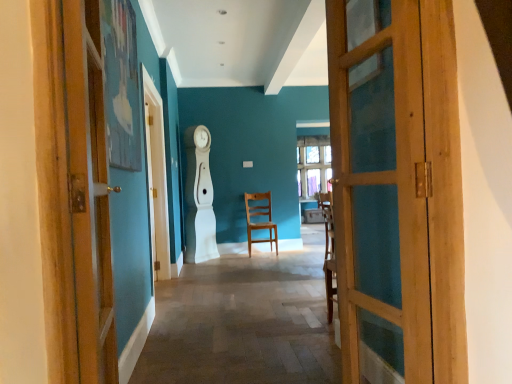
Question: Does wooden chair at center have a lesser width compared to wooden door at left, positioned as the 2th door in right-to-left order?

Choices:
 (A) no
 (B) yes

Answer: (A)

Question: Is wooden chair at center with wooden door at left, the first door viewed from the left?

Choices:
 (A) yes
 (B) no

Answer: (B)

Question: Is wooden chair at center taller than wooden door at left, positioned as the 2th door in right-to-left order?

Choices:
 (A) yes
 (B) no

Answer: (B)

Question: From a real-world perspective, is wooden chair at center on wooden door at left, positioned as the 2th door in right-to-left order?

Choices:
 (A) no
 (B) yes

Answer: (A)

Question: Is wooden chair at center at the left side of wooden door at left, positioned as the 2th door in right-to-left order?

Choices:
 (A) no
 (B) yes

Answer: (A)

Question: Is wooden chair at center positioned far away from wooden door at left, the first door viewed from the left?

Choices:
 (A) no
 (B) yes

Answer: (B)

Question: Does wooden door at left, positioned as the 2th door in right-to-left order, have a lesser width compared to wooden chair at center?

Choices:
 (A) no
 (B) yes

Answer: (B)

Question: Considering the relative sizes of wooden door at left, the first door viewed from the left, and wooden chair at center in the image provided, is wooden door at left, the first door viewed from the left, bigger than wooden chair at center?

Choices:
 (A) no
 (B) yes

Answer: (A)

Question: From the image's perspective, is wooden door at left, the first door viewed from the left, on top of wooden chair at center?

Choices:
 (A) yes
 (B) no

Answer: (A)

Question: Is wooden door at left, the first door viewed from the left, with wooden chair at center?

Choices:
 (A) no
 (B) yes

Answer: (A)

Question: Considering the relative positions of wooden door at left, the first door viewed from the left, and wooden chair at center in the image provided, is wooden door at left, the first door viewed from the left, to the right of wooden chair at center from the viewer's perspective?

Choices:
 (A) yes
 (B) no

Answer: (B)

Question: Is wooden door at left, the first door viewed from the left, taller than wooden chair at center?

Choices:
 (A) yes
 (B) no

Answer: (A)

Question: Does wooden chair at center have a greater height compared to wooden door at right, the 1th door viewed from the right?

Choices:
 (A) no
 (B) yes

Answer: (A)